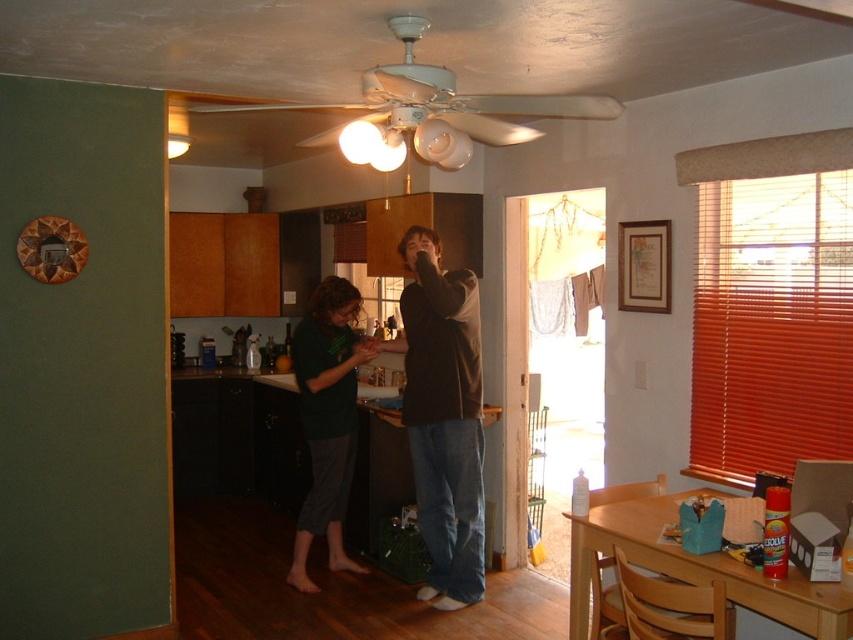
You are a delivery person who needs to place a small package on the counter between the brown cotton shirt at center and the white plastic fan at upper center. Can you fit it there?

The brown cotton shirt at center has a lesser width compared to white plastic fan at upper center, so there is enough space between them to fit a small package.

You are a guest in this home and want to know where the dark green fabric shirt at center is located relative to the white plastic fan at upper center. Can you describe their positions?

The dark green fabric shirt at center is positioned on the right side of the white plastic fan at upper center.

Based on the photo, in the image, there are a brown cotton shirt at center and a white plastic fan at upper center. Based on their positions, which object is located to the left of the other?

The brown cotton shirt at center is to the right of the white plastic fan at upper center, so the white plastic fan at upper center is to the left of the brown cotton shirt at center.